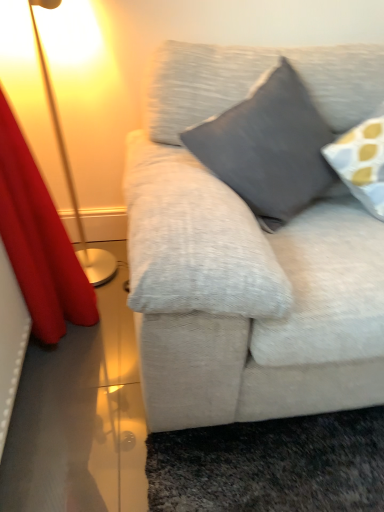
Question: From the image's perspective, is dark gray fabric pillow at center below metallic gold lamp at left?

Choices:
 (A) yes
 (B) no

Answer: (A)

Question: From a real-world perspective, is dark gray fabric pillow at center beneath metallic gold lamp at left?

Choices:
 (A) no
 (B) yes

Answer: (A)

Question: Is dark gray fabric pillow at center positioned behind metallic gold lamp at left?

Choices:
 (A) yes
 (B) no

Answer: (B)

Question: Would you say dark gray fabric pillow at center is outside metallic gold lamp at left?

Choices:
 (A) yes
 (B) no

Answer: (A)

Question: Is dark gray fabric pillow at center thinner than metallic gold lamp at left?

Choices:
 (A) yes
 (B) no

Answer: (B)

Question: Does point (79, 309) appear closer or farther from the camera than point (36, 28)?

Choices:
 (A) closer
 (B) farther

Answer: (B)

Question: In terms of height, does red velvet curtain at left look taller or shorter compared to metallic gold lamp at left?

Choices:
 (A) short
 (B) tall

Answer: (B)

Question: Would you say red velvet curtain at left is inside or outside metallic gold lamp at left?

Choices:
 (A) inside
 (B) outside

Answer: (B)

Question: From a real-world perspective, is red velvet curtain at left positioned above or below metallic gold lamp at left?

Choices:
 (A) below
 (B) above

Answer: (B)

Question: From a real-world perspective, is dark gray fabric pillow at center above or below red velvet curtain at left?

Choices:
 (A) above
 (B) below

Answer: (A)

Question: From their relative heights in the image, would you say dark gray fabric pillow at center is taller or shorter than red velvet curtain at left?

Choices:
 (A) tall
 (B) short

Answer: (B)

Question: From the image's perspective, is dark gray fabric pillow at center positioned above or below red velvet curtain at left?

Choices:
 (A) below
 (B) above

Answer: (B)

Question: Based on their positions, is dark gray fabric pillow at center located to the left or right of red velvet curtain at left?

Choices:
 (A) left
 (B) right

Answer: (B)

Question: From a real-world perspective, is red velvet curtain at left above or below dark gray fabric pillow at center?

Choices:
 (A) above
 (B) below

Answer: (B)

Question: Considering their positions, is red velvet curtain at left located in front of or behind dark gray fabric pillow at center?

Choices:
 (A) front
 (B) behind

Answer: (A)